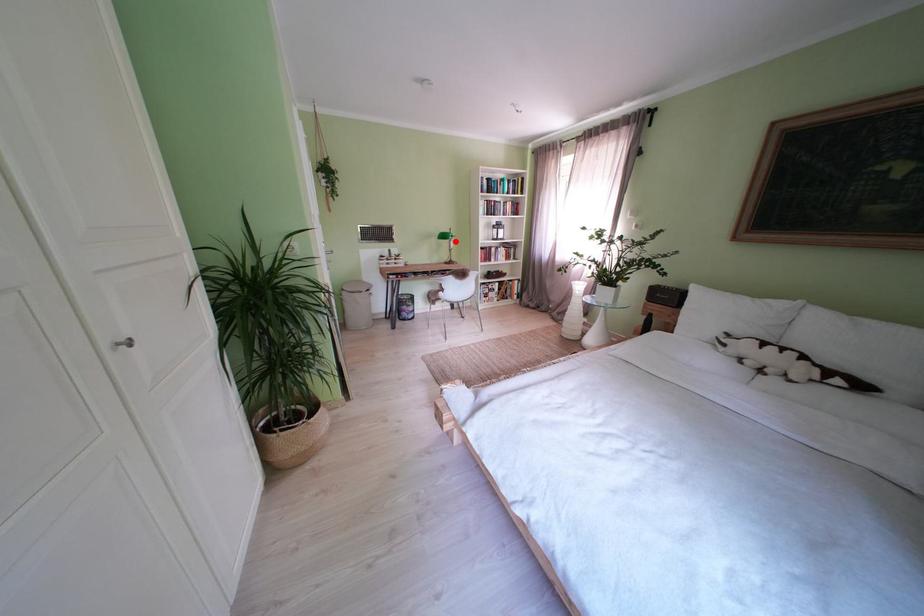
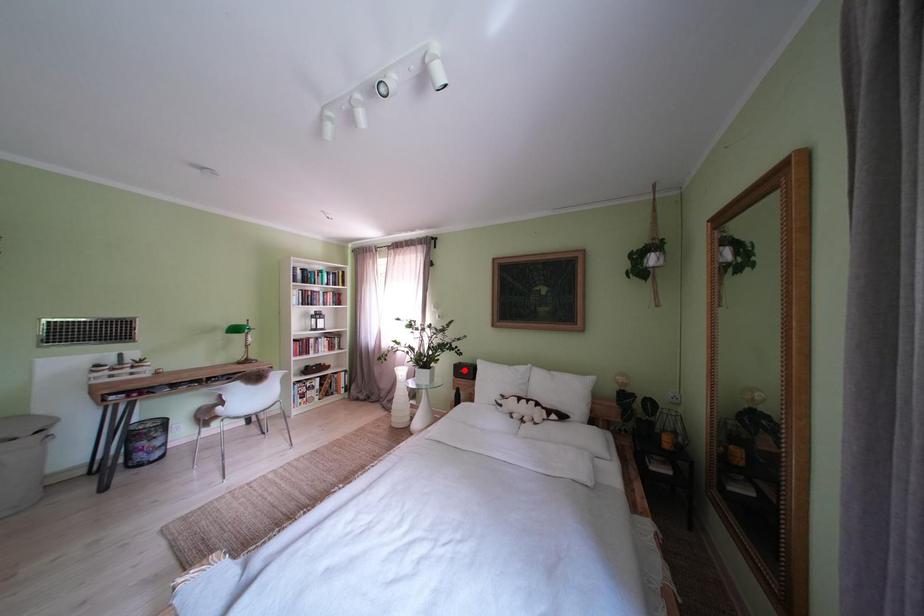
I am providing you with two images of the same scene from different viewpoints. A red point is marked on the first image and another point is marked on the second image. Does the point marked in image1 correspond to the same location as the one in image2?

No